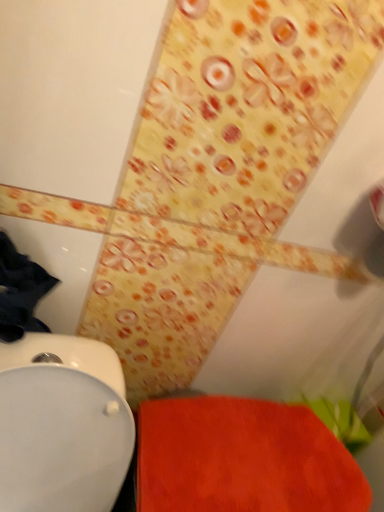
You are a GUI agent. You are given a task and a screenshot of the screen. Output one action in this format:
    pyautogui.click(x=<x>, y=<y>)
    Task: Click on the free space above orange fabric bath mat at lower right (from a real-world perspective)
    The height and width of the screenshot is (512, 384).
    Given the screenshot: What is the action you would take?
    pyautogui.click(x=258, y=448)